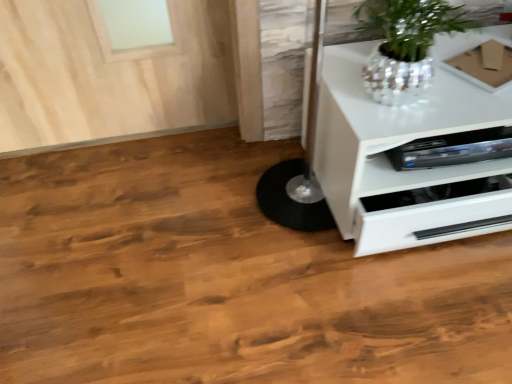
This screenshot has width=512, height=384. Find the location of `free point below shiny metallic pot at upper right (from a real-world perspective)`. free point below shiny metallic pot at upper right (from a real-world perspective) is located at coordinates (402, 102).